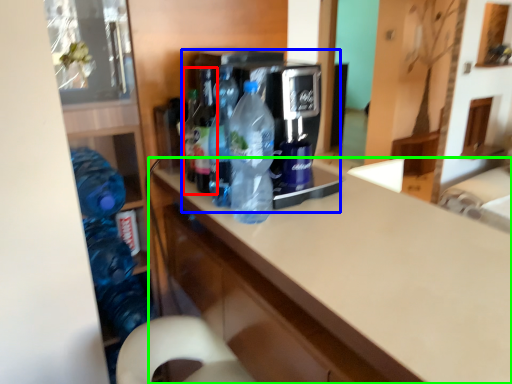
Question: Which object is the closest to the bottle (highlighted by a red box)? Choose among these: appliance (highlighted by a blue box) or countertop (highlighted by a green box).

Choices:
 (A) appliance
 (B) countertop

Answer: (A)